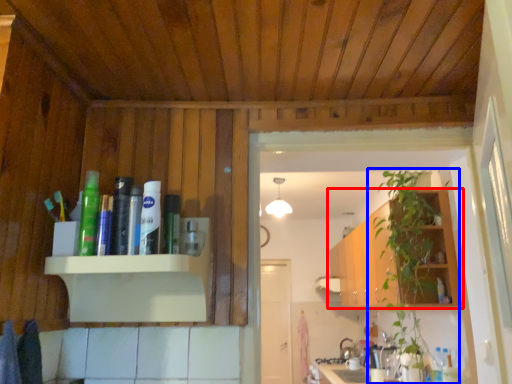
Question: Which object appears farthest to the camera in this image, cabinetry (highlighted by a red box) or houseplant (highlighted by a blue box)?

Choices:
 (A) cabinetry
 (B) houseplant

Answer: (A)